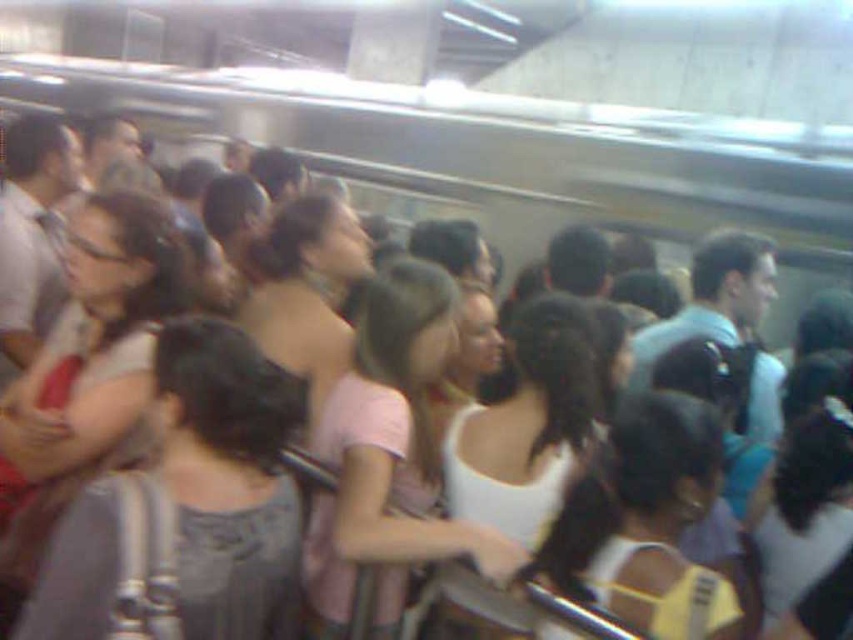
You are a commuter trying to retrieve your belongings in the subway station. You notice both the white matte backpack at center and the white matte shirt at center. Which item is covering the other?

The white matte backpack at center is positioned over white matte shirt at center, so the backpack is covering the shirt.

You are a photographer standing at the entrance of the subway station. You want to take a photo that includes both the point at coordinates point (x=450, y=282) and point (x=50, y=460). Which point should you focus on first to ensure both are in focus?

You should focus on point (x=450, y=282) first because it is further away from the camera than point (x=50, y=460), ensuring both will be in focus when focusing on the farther point.